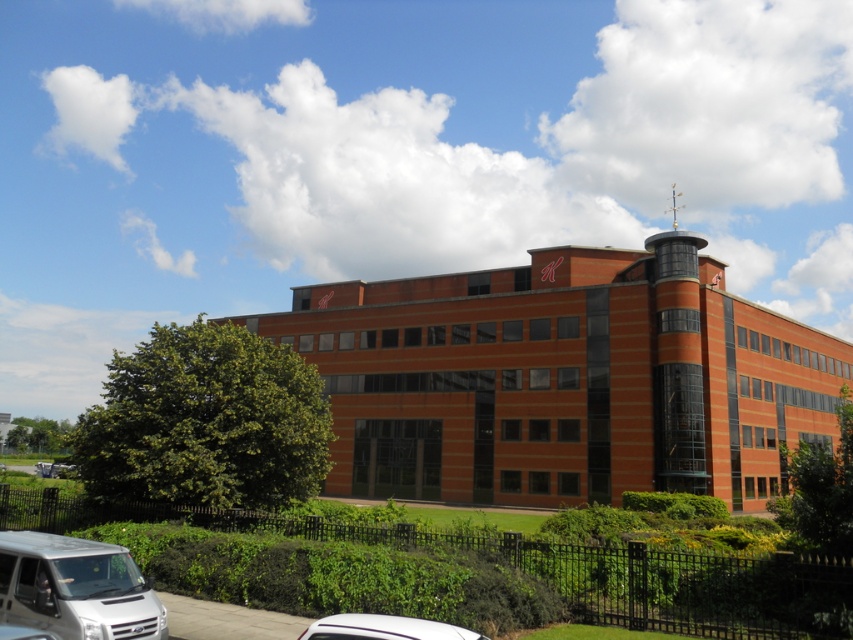
Question: Which is nearer to the green leafy hedge at lower left?

Choices:
 (A) white matte van at lower left
 (B) white glossy car at lower center

Answer: (A)

Question: Does green leafy hedge at lower left appear on the left side of white glossy car at lower center?

Choices:
 (A) no
 (B) yes

Answer: (B)

Question: Does green leafy hedge at lower left lie in front of white glossy car at lower center?

Choices:
 (A) yes
 (B) no

Answer: (B)

Question: Which point is farther to the camera?

Choices:
 (A) (234, 500)
 (B) (310, 627)

Answer: (A)

Question: Which of the following is the closest to the observer?

Choices:
 (A) (160, 600)
 (B) (328, 413)

Answer: (A)

Question: Is white matte van at lower left further to the viewer compared to white glossy car at lower center?

Choices:
 (A) no
 (B) yes

Answer: (B)